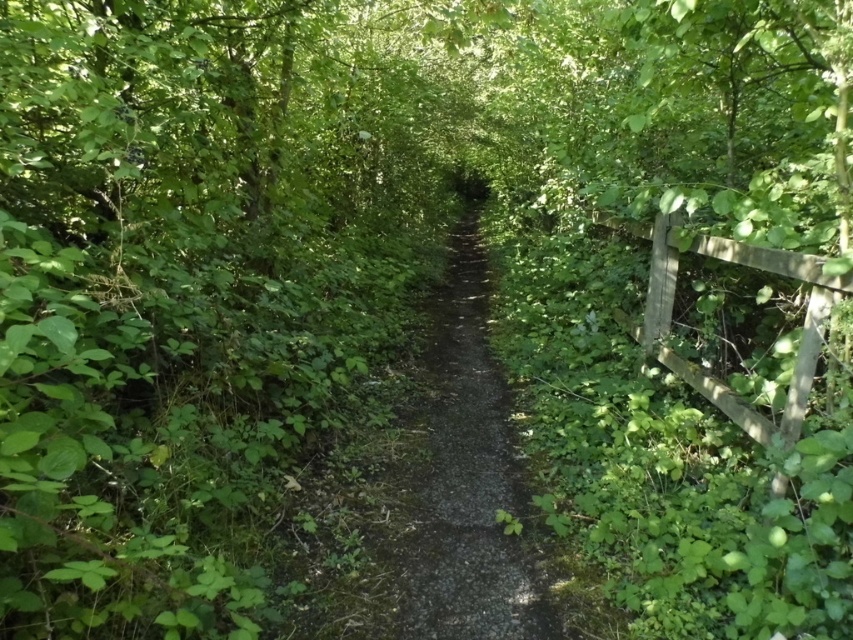
Which is behind, point (474, 403) or point (637, 234)?

Point (637, 234)

Find the location of a particular element. The height and width of the screenshot is (640, 853). dirt/gravel path at center is located at coordinates (465, 481).

Image resolution: width=853 pixels, height=640 pixels. Identify the location of dirt/gravel path at center. (465, 481).